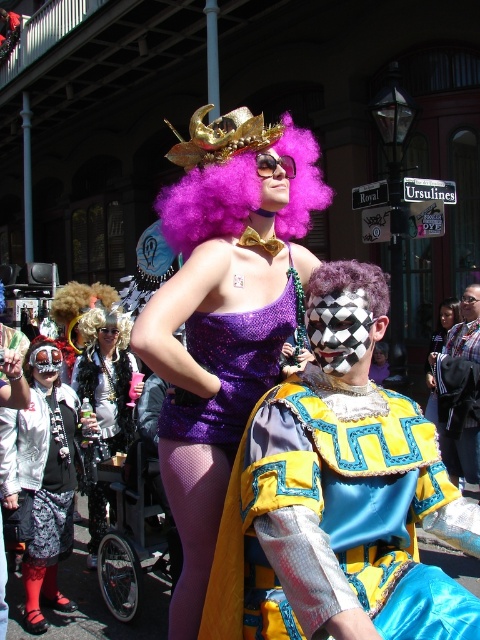
Question: Does fuzzy black wig at upper center appear on the left side of matte black wig at upper center?

Choices:
 (A) no
 (B) yes

Answer: (B)

Question: Which point is farther to the camera?

Choices:
 (A) curly blonde wig at upper left
 (B) purple curly wig at center
 (C) fuzzy black wig at upper center

Answer: (A)

Question: From the image, what is the correct spatial relationship of blue denim jacket at center in relation to curly blonde wig at upper left?

Choices:
 (A) right
 (B) left

Answer: (A)

Question: Is the position of shiny blonde wig at center more distant than that of black matte wig at center?

Choices:
 (A) yes
 (B) no

Answer: (B)

Question: Which of the following is the closest to the observer?

Choices:
 (A) fuzzy black wig at upper center
 (B) blue denim jacket at center
 (C) shiny yellow fabric at center

Answer: (C)

Question: Which object is closer to the camera taking this photo?

Choices:
 (A) matte black mask at center
 (B) purple sequined dress at center

Answer: (B)